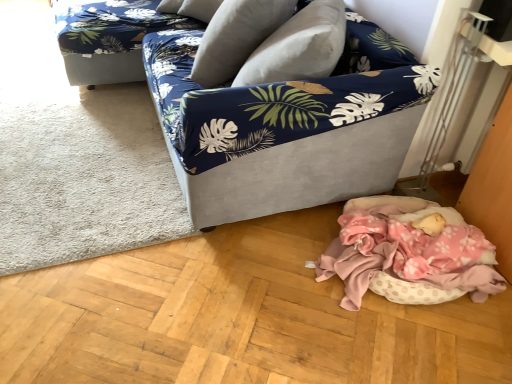
Question: From a real-world perspective, is white soft rug at lower left positioned above or below blue floral fabric couch at upper left?

Choices:
 (A) below
 (B) above

Answer: (A)

Question: Is white soft rug at lower left spatially inside blue floral fabric couch at upper left, or outside of it?

Choices:
 (A) outside
 (B) inside

Answer: (A)

Question: Which object is positioned farthest from the white soft rug at lower left?

Choices:
 (A) velvet fabric couch at center
 (B) velvet-like beige pillow at upper center
 (C) pink polka dot fabric at lower right
 (D) blue floral fabric couch at upper left

Answer: (C)

Question: Considering the real-world distances, which object is farthest from the pink polka dot fabric at lower right?

Choices:
 (A) velvet-like beige pillow at upper center
 (B) white soft rug at lower left
 (C) velvet fabric couch at center
 (D) blue floral fabric couch at upper left

Answer: (D)